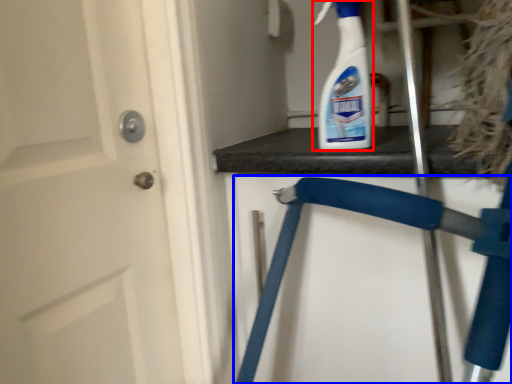
Question: Which point is closer to the camera, cleaning product (highlighted by a red box) or folding chair (highlighted by a blue box)?

Choices:
 (A) cleaning product
 (B) folding chair

Answer: (B)